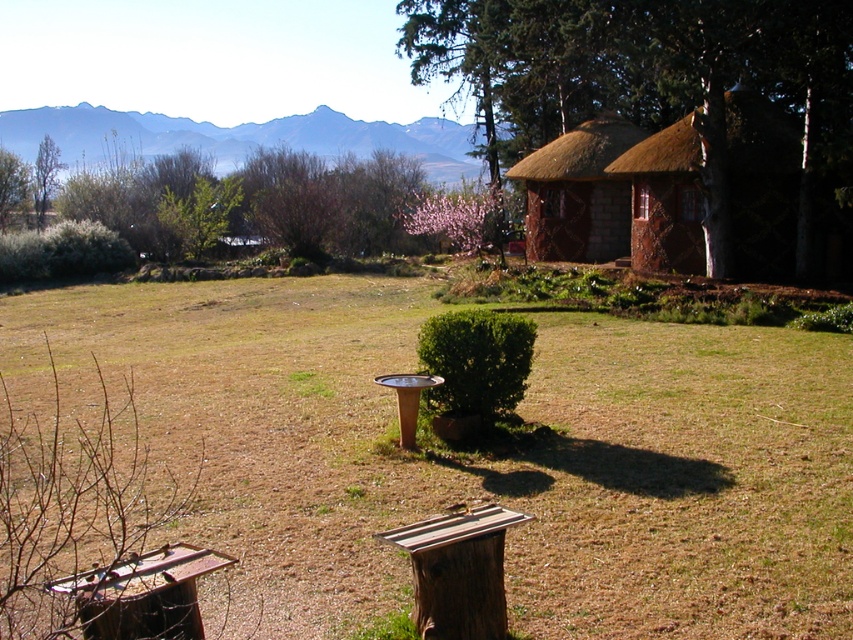
Question: Among these points, which one is nearest to the camera?

Choices:
 (A) pos(631,13)
 (B) pos(701,272)
 (C) pos(665,486)
 (D) pos(608,253)

Answer: (C)

Question: Is brown wooden bird bath at center to the right of thatched wood hut at right from the viewer's perspective?

Choices:
 (A) yes
 (B) no

Answer: (B)

Question: Can you confirm if brown wooden bird bath at center is positioned below thatched wood hut at right?

Choices:
 (A) no
 (B) yes

Answer: (B)

Question: Can you confirm if brown thatch hut at upper right is positioned above brown wooden stump at lower center?

Choices:
 (A) no
 (B) yes

Answer: (B)

Question: Which point appears farthest from the camera in this image?

Choices:
 (A) (463, 600)
 (B) (582, 189)

Answer: (B)

Question: Among these objects, which one is nearest to the camera?

Choices:
 (A) brown thatch hut at upper right
 (B) thatched wood hut at right
 (C) brown wooden stump at lower center

Answer: (C)